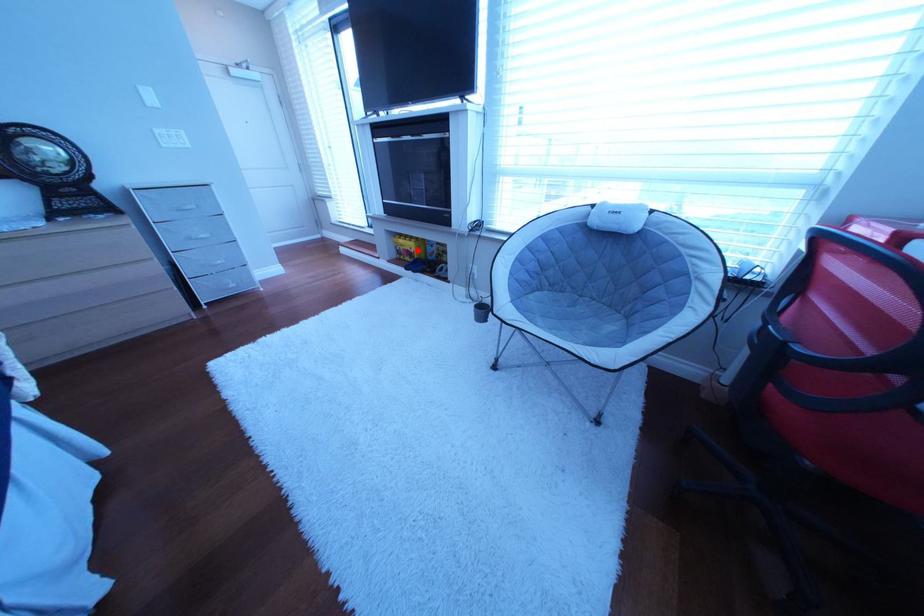
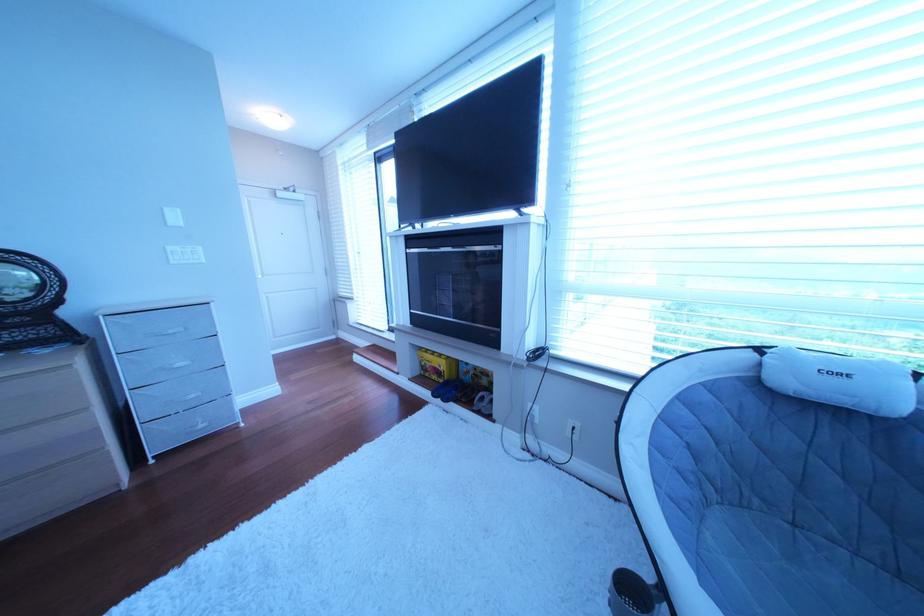
Question: I am providing you with two images of the same scene from different viewpoints. Image1 has a red point marked. In image2, the corresponding 3D location appears at what relative position? Reply with the corresponding letter.

Choices:
 (A) Closer
 (B) Farther

Answer: (B)